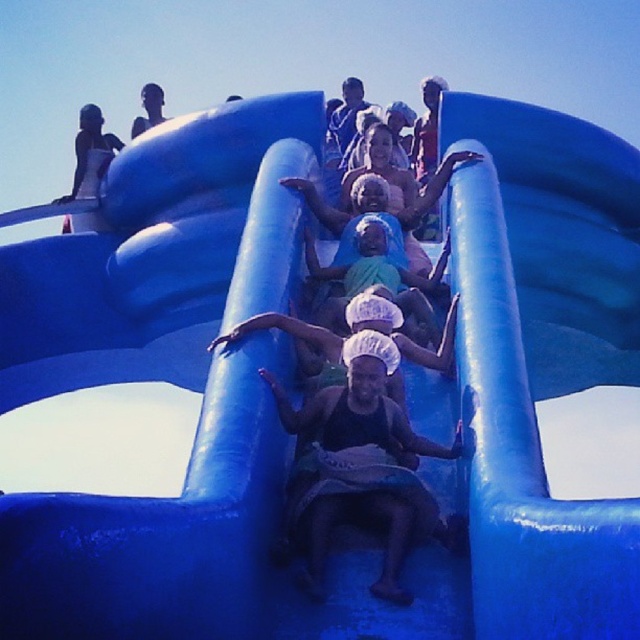
You are standing at the camera position and want to hand a towel to the person wearing the matte white swimsuit at upper left. Considering the distance, can you reach them without moving from your current position?

The matte white swimsuit at upper left is 110.15 meters away from the camera, so you cannot reach them without moving from your current position.

You are at the water park and see a person wearing a matte white swimsuit at upper left and a matte black towel at center. Which item is positioned to the right of the other?

The matte black towel at center is to the right of the matte white swimsuit at upper left.